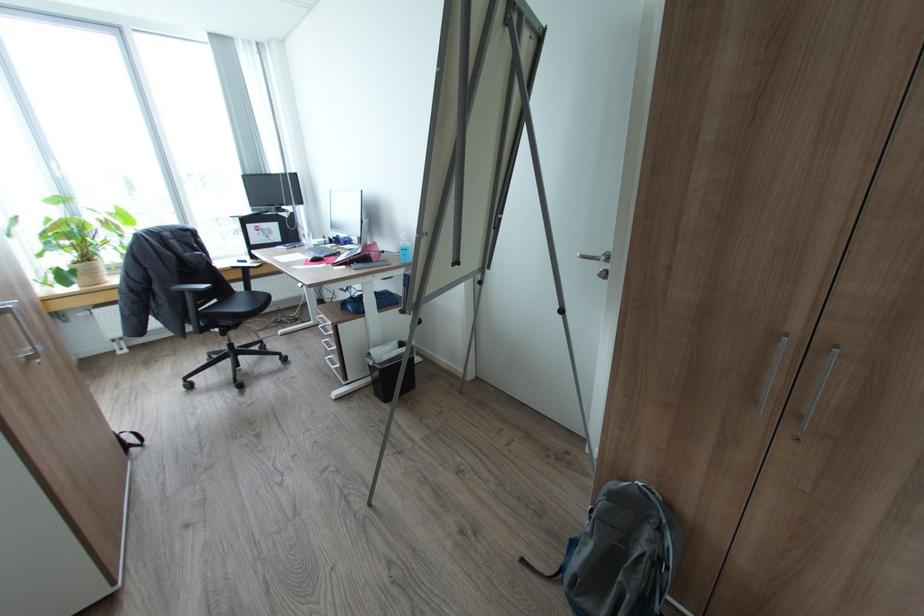
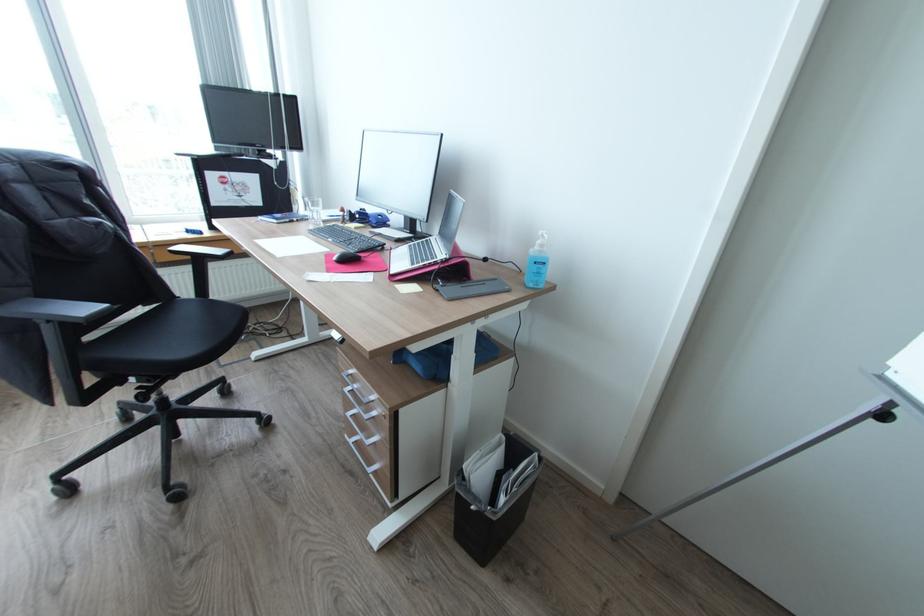
Where in the second image is the point corresponding to (x=408, y=240) from the first image?

(545, 245)